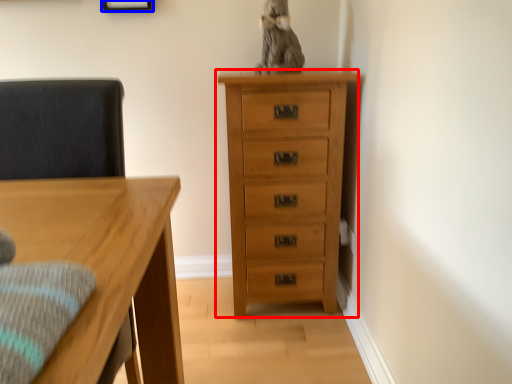
Question: Which of the following is the closest to the observer, chest of drawers (highlighted by a red box) or picture frame (highlighted by a blue box)?

Choices:
 (A) chest of drawers
 (B) picture frame

Answer: (A)